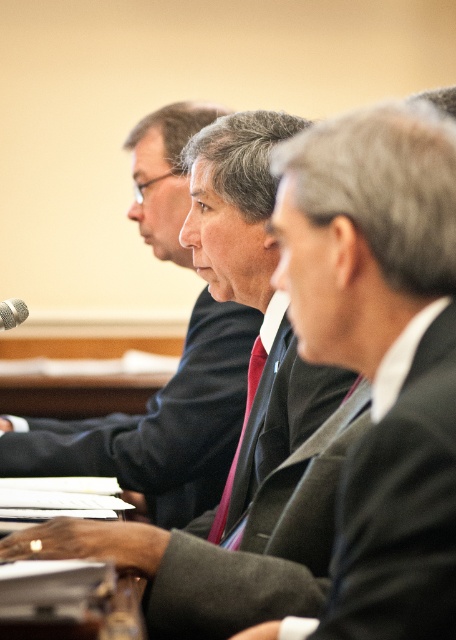
You are standing in front of the table where the three individuals are seated. You need to place a name tag exactly at the center of the dark gray suit at center. According to the coordinates provided, where should you place the name tag?

The name tag should be placed at the coordinates point (253, 412), as that is the 2D location of the dark gray suit at center.

You are standing at the point labeled as point (243, 424) in the image. If you want to move to the door located at the far end of the room, which direction should you go?

Since the point (243, 424) is 1.67 meters away from the viewer, you should move towards the direction away from the viewer to reach the door at the far end of the room.